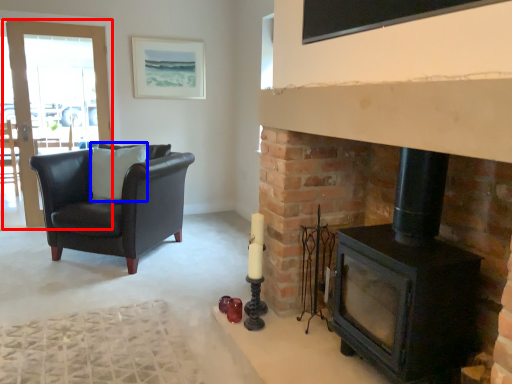
Question: Which of the following is the closest to the observer, screen door (highlighted by a red box) or pillow (highlighted by a blue box)?

Choices:
 (A) screen door
 (B) pillow

Answer: (B)